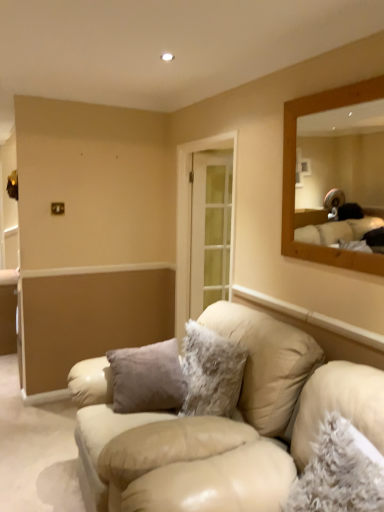
Question: Which direction should I rotate to look at fuzzy white pillow at center, the second pillow from the front?

Choices:
 (A) left
 (B) right

Answer: (B)

Question: Is fuzzy gray pillow at lower right, which is counted as the 2th pillow, starting from the left, in front of fuzzy white pillow at center, the second pillow positioned from the right?

Choices:
 (A) yes
 (B) no

Answer: (A)

Question: From a real-world perspective, is fuzzy gray pillow at lower right, positioned as the 1th pillow in right-to-left order, positioned under fuzzy white pillow at center, the second pillow from the front, based on gravity?

Choices:
 (A) yes
 (B) no

Answer: (B)

Question: Does fuzzy gray pillow at lower right, positioned as the 1th pillow in right-to-left order, have a lesser width compared to fuzzy white pillow at center, the second pillow from the front?

Choices:
 (A) yes
 (B) no

Answer: (B)

Question: Is fuzzy gray pillow at lower right, positioned as the 1th pillow in right-to-left order, bigger than fuzzy white pillow at center, the second pillow positioned from the right?

Choices:
 (A) no
 (B) yes

Answer: (A)

Question: Can you confirm if fuzzy gray pillow at lower right, the first pillow in the front-to-back sequence, is shorter than fuzzy white pillow at center, acting as the first pillow starting from the left?

Choices:
 (A) no
 (B) yes

Answer: (B)

Question: Is fuzzy gray pillow at lower right, positioned as the 1th pillow in right-to-left order, with fuzzy white pillow at center, acting as the first pillow starting from the left?

Choices:
 (A) yes
 (B) no

Answer: (B)

Question: Is fuzzy white pillow at center, the second pillow positioned from the right, shorter than fuzzy gray pillow at lower right, which is counted as the 2th pillow, starting from the left?

Choices:
 (A) no
 (B) yes

Answer: (A)

Question: Can you confirm if fuzzy white pillow at center, marked as the first pillow in a back-to-front arrangement, is bigger than fuzzy gray pillow at lower right, which is counted as the 2th pillow, starting from the left?

Choices:
 (A) no
 (B) yes

Answer: (B)

Question: Could you tell me if fuzzy white pillow at center, marked as the first pillow in a back-to-front arrangement, is facing fuzzy gray pillow at lower right, which is counted as the 2th pillow, starting from the left?

Choices:
 (A) yes
 (B) no

Answer: (B)

Question: Does fuzzy white pillow at center, the second pillow from the front, have a lesser width compared to fuzzy gray pillow at lower right, the first pillow in the front-to-back sequence?

Choices:
 (A) no
 (B) yes

Answer: (B)

Question: Is fuzzy white pillow at center, the second pillow from the front, smaller than fuzzy gray pillow at lower right, which is the second pillow from back to front?

Choices:
 (A) yes
 (B) no

Answer: (B)

Question: Considering the relative positions of fuzzy white pillow at center, the second pillow from the front, and fuzzy gray pillow at lower right, the first pillow in the front-to-back sequence, in the image provided, is fuzzy white pillow at center, the second pillow from the front, behind fuzzy gray pillow at lower right, the first pillow in the front-to-back sequence,?

Choices:
 (A) no
 (B) yes

Answer: (B)

Question: Is fuzzy gray pillow at lower right, positioned as the 1th pillow in right-to-left order, next to beige leather couch at center and touching it?

Choices:
 (A) yes
 (B) no

Answer: (B)